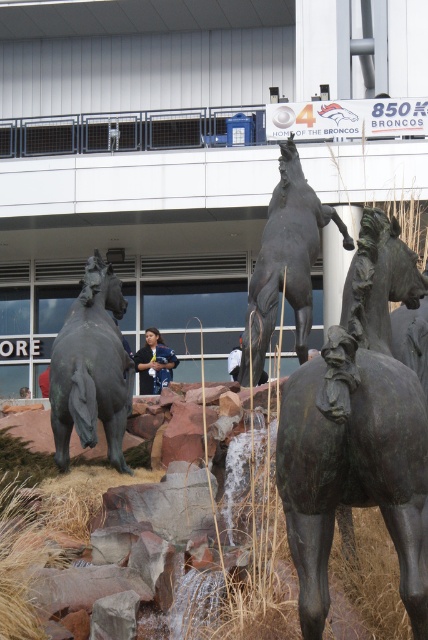
Between bronze textured horse at center and bronze horse at left, which one has less height?

Standing shorter between the two is bronze textured horse at center.

Is bronze textured horse at center taller than bronze horse at left?

Incorrect, bronze textured horse at center's height is not larger of bronze horse at left's.

Who is more forward, (369, 241) or (68, 428)?

Positioned in front is point (369, 241).

The width and height of the screenshot is (428, 640). Find the location of `bronze textured horse at center`. bronze textured horse at center is located at coordinates [x=359, y=429].

Which is in front, point (371, 252) or point (145, 372)?

Point (371, 252)

Between point (385, 372) and point (145, 384), which one is positioned in front?

Point (385, 372) is in front.

I want to click on bronze textured horse at center, so click(359, 429).

Which is more to the left, bronze textured horse at center or bronze horse at upper center?

bronze horse at upper center is more to the left.

Who is shorter, bronze textured horse at center or bronze horse at upper center?

Standing shorter between the two is bronze textured horse at center.

Does point (318, 563) come behind point (315, 236)?

No, it is in front of (315, 236).

Image resolution: width=428 pixels, height=640 pixels. Find the location of `bronze textured horse at center`. bronze textured horse at center is located at coordinates (359, 429).